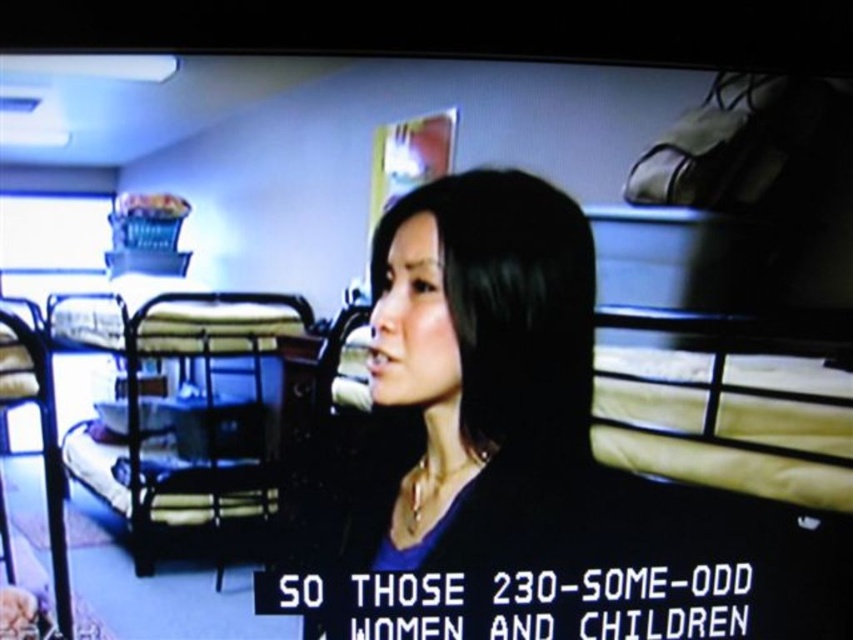
Question: Where is black matte hair at center located in relation to metallic silver bunk bed at left in the image?

Choices:
 (A) left
 (B) right

Answer: (B)

Question: Among these points, which one is farthest from the camera?

Choices:
 (A) (195, 307)
 (B) (527, 410)

Answer: (B)

Question: Is black matte hair at center behind metallic silver bunk bed at left?

Choices:
 (A) no
 (B) yes

Answer: (B)

Question: In this image, where is black matte hair at center located relative to metallic silver bunk bed at left?

Choices:
 (A) above
 (B) below

Answer: (B)